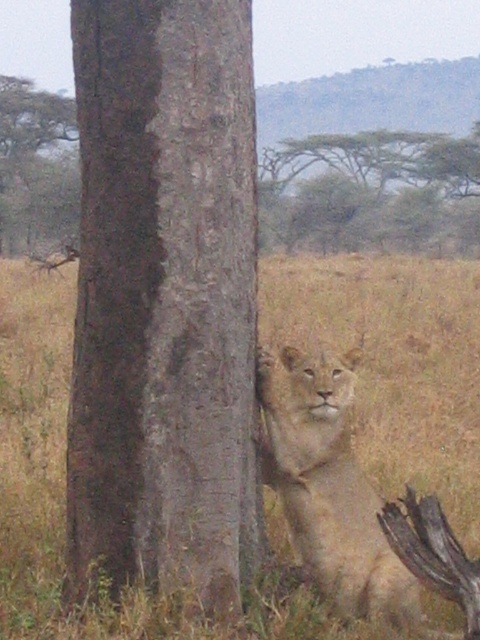
Is brown rough bark at center closer to camera compared to light brown fur lion at center?

Yes, it is in front of light brown fur lion at center.

Is brown rough bark at center smaller than light brown fur lion at center?

No.

Between point (189, 84) and point (320, 582), which one is positioned behind?

The point (320, 582) is behind.

I want to click on brown rough bark at center, so click(x=165, y=300).

Which is more to the right, dry grass at center or light brown fur lion at center?

light brown fur lion at center

Does point (377, 387) come farther from viewer compared to point (360, 557)?

Yes, it is.

Find the location of a particular element. Image resolution: width=480 pixels, height=640 pixels. dry grass at center is located at coordinates (396, 364).

How much distance is there between brown rough bark at center and smooth bark tree at upper left?

The distance of brown rough bark at center from smooth bark tree at upper left is 134.47 feet.

Find the location of `brown rough bark at center`. brown rough bark at center is located at coordinates (165, 300).

You are a GUI agent. You are given a task and a screenshot of the screen. Output one action in this format:
    pyautogui.click(x=<x>, y=<y>)
    Task: Click on the brown rough bark at center
    The height and width of the screenshot is (640, 480).
    Given the screenshot: What is the action you would take?
    pyautogui.click(x=165, y=300)